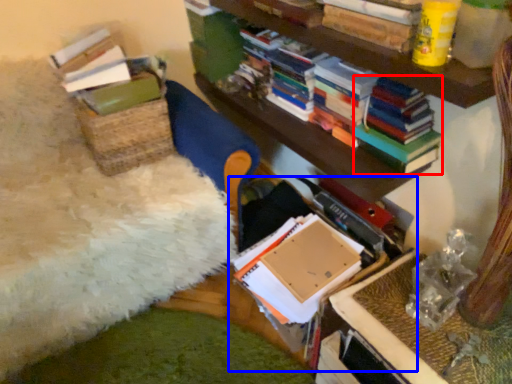
Question: Among these objects, which one is nearest to the camera, magazine (highlighted by a red box) or book (highlighted by a blue box)?

Choices:
 (A) magazine
 (B) book

Answer: (B)